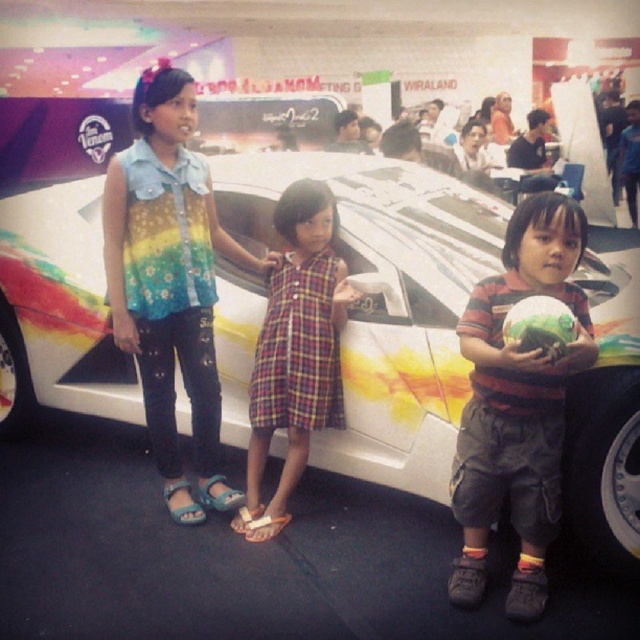
Question: Which point is farther to the camera?

Choices:
 (A) striped cotton shirt at center
 (B) denim shirt at center

Answer: (B)

Question: Can you confirm if denim shirt at center is wider than striped cotton shirt at center?

Choices:
 (A) no
 (B) yes

Answer: (B)

Question: Is white glossy car at center positioned before striped cotton shirt at center?

Choices:
 (A) no
 (B) yes

Answer: (A)

Question: Which of the following is the closest to the observer?

Choices:
 (A) (292, 164)
 (B) (316, 404)
 (C) (584, 362)
 (D) (144, 195)

Answer: (C)

Question: Can you confirm if white glossy car at center is smaller than striped cotton shirt at center?

Choices:
 (A) no
 (B) yes

Answer: (A)

Question: Which is nearer to the plaid fabric dress at center?

Choices:
 (A) white glossy car at center
 (B) striped cotton shirt at center

Answer: (A)